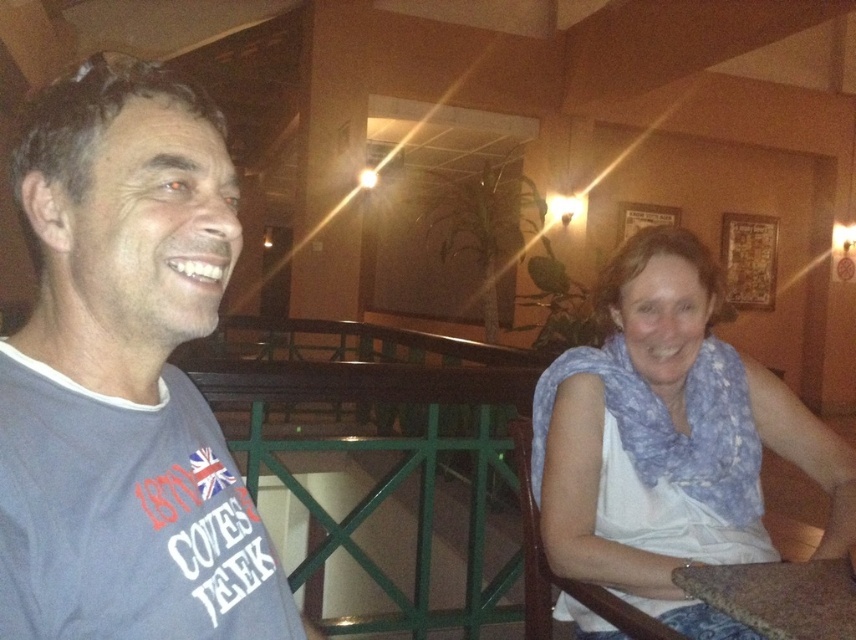
Which of these two, blue printed scarf at right or brown fabric table at lower right, stands shorter?

brown fabric table at lower right

Is blue printed scarf at right to the left of brown fabric table at lower right from the viewer's perspective?

In fact, blue printed scarf at right is to the right of brown fabric table at lower right.

Locate an element on the screen. This screenshot has height=640, width=856. blue printed scarf at right is located at coordinates (669, 440).

Does gray t-shirt at left lie in front of blue printed scarf at right?

Yes, it is.

Which is above, gray t-shirt at left or blue printed scarf at right?

gray t-shirt at left

What do you see at coordinates (125, 378) in the screenshot?
I see `gray t-shirt at left` at bounding box center [125, 378].

The height and width of the screenshot is (640, 856). Identify the location of gray t-shirt at left. (125, 378).

Identify the location of gray t-shirt at left. (125, 378).